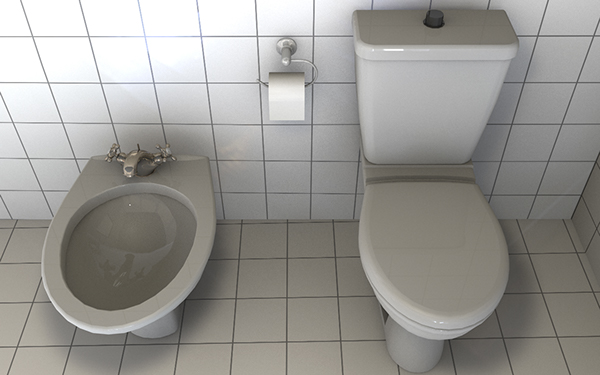
Locate an element on the screen. The width and height of the screenshot is (600, 375). toilet paper is located at coordinates (284, 93).